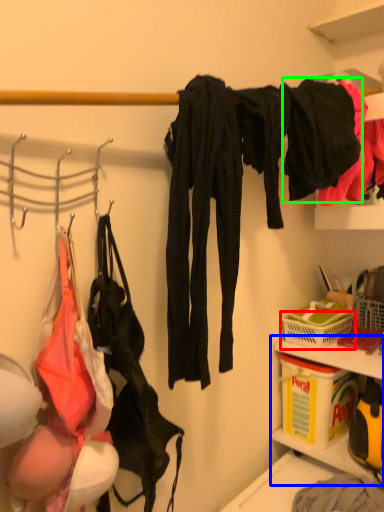
Question: Based on their relative distances, which object is farther from basket (highlighted by a red box)? Choose from cabinet (highlighted by a blue box) and clothing (highlighted by a green box).

Choices:
 (A) cabinet
 (B) clothing

Answer: (B)